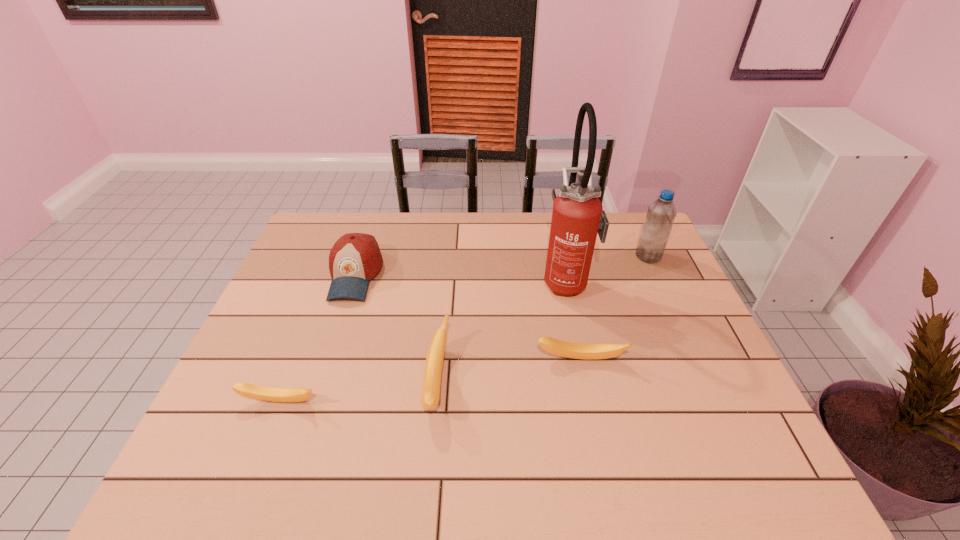
Identify the location of free space located at the stem of the second shortest banana. Image resolution: width=960 pixels, height=540 pixels. [x=585, y=383].

Locate an element on the screen. vacant space located 0.230m on the front-facing side of the third tallest object is located at coordinates (324, 369).

Where is `vacant space located 0.300m at the nozzle of the tallest object`? vacant space located 0.300m at the nozzle of the tallest object is located at coordinates (445, 281).

Locate an element on the screen. vacant space located 0.360m at the nozzle of the tallest object is located at coordinates (425, 281).

The image size is (960, 540). I want to click on vacant region located at the nozzle of the tallest object, so click(481, 281).

Identify the location of free region located 0.070m on the front of the water bottle. The image size is (960, 540). (659, 279).

Where is `baseball cap positioned at the far edge`? This screenshot has height=540, width=960. baseball cap positioned at the far edge is located at coordinates (355, 258).

You are a GUI agent. You are given a task and a screenshot of the screen. Output one action in this format:
    pyautogui.click(x=<x>, y=<y>)
    Task: Click on the water bottle that is at the far edge
    
    Given the screenshot: What is the action you would take?
    pyautogui.click(x=661, y=214)

Identify the location of banana that is at the left edge. The width and height of the screenshot is (960, 540). (252, 391).

You are a GUI agent. You are given a task and a screenshot of the screen. Output one action in this format:
    pyautogui.click(x=<x>, y=<y>)
    Task: Click on the baseball cap situated at the left edge
    The width and height of the screenshot is (960, 540).
    Given the screenshot: What is the action you would take?
    pyautogui.click(x=355, y=258)